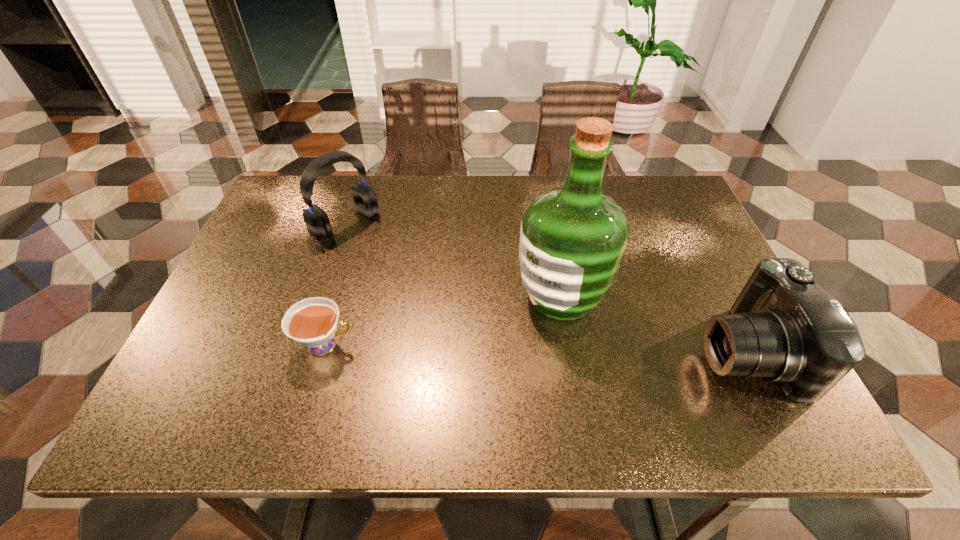
Where is `blank space at the far right corner`? blank space at the far right corner is located at coordinates (629, 184).

Find the location of a particular element. This screenshot has height=540, width=960. empty space between the teacup and the farthest object is located at coordinates (336, 285).

You are a GUI agent. You are given a task and a screenshot of the screen. Output one action in this format:
    pyautogui.click(x=<x>, y=<y>)
    Task: Click on the free space between the camera and the second object from right to left
    This screenshot has height=540, width=960.
    Given the screenshot: What is the action you would take?
    pyautogui.click(x=654, y=324)

Locate an element on the screen. vacant point located between the camera and the liquor is located at coordinates (654, 324).

You are a GUI agent. You are given a task and a screenshot of the screen. Output one action in this format:
    pyautogui.click(x=<x>, y=<y>)
    Task: Click on the empty location between the third object from left to right and the camera
    
    Given the screenshot: What is the action you would take?
    pyautogui.click(x=654, y=324)

This screenshot has width=960, height=540. I want to click on free space that is in between the shortest object and the tallest object, so click(444, 321).

The width and height of the screenshot is (960, 540). Find the location of `free point between the teacup and the tallest object`. free point between the teacup and the tallest object is located at coordinates (444, 321).

Locate an element on the screen. The width and height of the screenshot is (960, 540). vacant area that lies between the camera and the shortest object is located at coordinates (536, 348).

At what (x,y) coordinates should I click in order to perform the action: click on object that is the closest to the tallest object. Please return your answer as a coordinate pair (x, y). Looking at the image, I should click on (784, 328).

Identify which object is the third nearest to the headset. Please provide its 2D coordinates. Your answer should be formatted as a tuple, i.e. [(x, y)], where the tuple contains the x and y coordinates of a point satisfying the conditions above.

[(784, 328)]